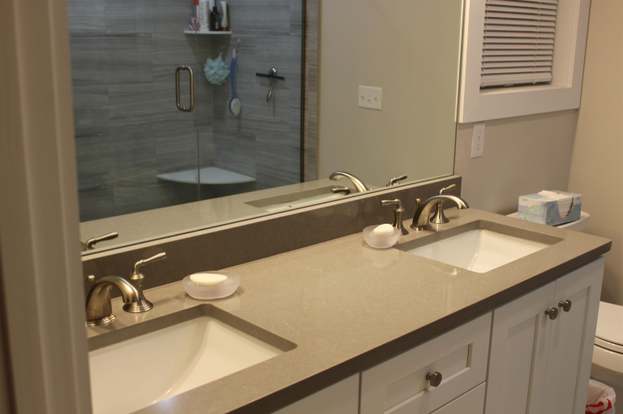
This screenshot has height=414, width=623. I want to click on right faucet, so click(x=455, y=198).